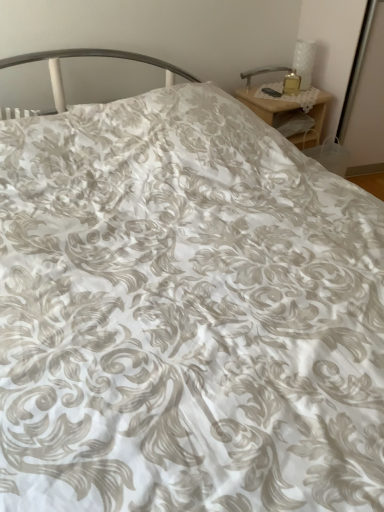
Question: Does metallic silver table lamp at upper right, which is the 2th table lamp from right to left, have a lesser height compared to white textured vase at upper right, acting as the 2th table lamp starting from the left?

Choices:
 (A) no
 (B) yes

Answer: (B)

Question: Is metallic silver table lamp at upper right, marked as the 1th table lamp in a left-to-right arrangement, located outside white textured vase at upper right, acting as the first table lamp starting from the right?

Choices:
 (A) no
 (B) yes

Answer: (B)

Question: Can you confirm if metallic silver table lamp at upper right, which is the 2th table lamp from right to left, is wider than white textured vase at upper right, acting as the first table lamp starting from the right?

Choices:
 (A) no
 (B) yes

Answer: (A)

Question: Does metallic silver table lamp at upper right, which is the 2th table lamp from right to left, appear on the left side of white textured vase at upper right, acting as the 2th table lamp starting from the left?

Choices:
 (A) no
 (B) yes

Answer: (B)

Question: From a real-world perspective, is metallic silver table lamp at upper right, marked as the 1th table lamp in a left-to-right arrangement, physically below white textured vase at upper right, acting as the first table lamp starting from the right?

Choices:
 (A) no
 (B) yes

Answer: (B)

Question: Does metallic silver table lamp at upper right, marked as the 1th table lamp in a left-to-right arrangement, turn towards white textured vase at upper right, acting as the 2th table lamp starting from the left?

Choices:
 (A) no
 (B) yes

Answer: (A)

Question: From a real-world perspective, is wooden nightstand at upper right on white textured vase at upper right, acting as the first table lamp starting from the right?

Choices:
 (A) no
 (B) yes

Answer: (A)

Question: Does wooden nightstand at upper right have a greater width compared to white textured vase at upper right, acting as the 2th table lamp starting from the left?

Choices:
 (A) no
 (B) yes

Answer: (B)

Question: Can you confirm if wooden nightstand at upper right is shorter than white textured vase at upper right, acting as the 2th table lamp starting from the left?

Choices:
 (A) no
 (B) yes

Answer: (A)

Question: Is wooden nightstand at upper right to the left of white textured vase at upper right, acting as the 2th table lamp starting from the left, from the viewer's perspective?

Choices:
 (A) yes
 (B) no

Answer: (A)

Question: Are wooden nightstand at upper right and white textured vase at upper right, acting as the first table lamp starting from the right, beside each other?

Choices:
 (A) yes
 (B) no

Answer: (B)

Question: Considering the relative sizes of wooden nightstand at upper right and white textured vase at upper right, acting as the first table lamp starting from the right, in the image provided, is wooden nightstand at upper right bigger than white textured vase at upper right, acting as the first table lamp starting from the right,?

Choices:
 (A) yes
 (B) no

Answer: (A)

Question: Could you tell me if white textured vase at upper right, acting as the 2th table lamp starting from the left, is facing wooden nightstand at upper right?

Choices:
 (A) yes
 (B) no

Answer: (B)